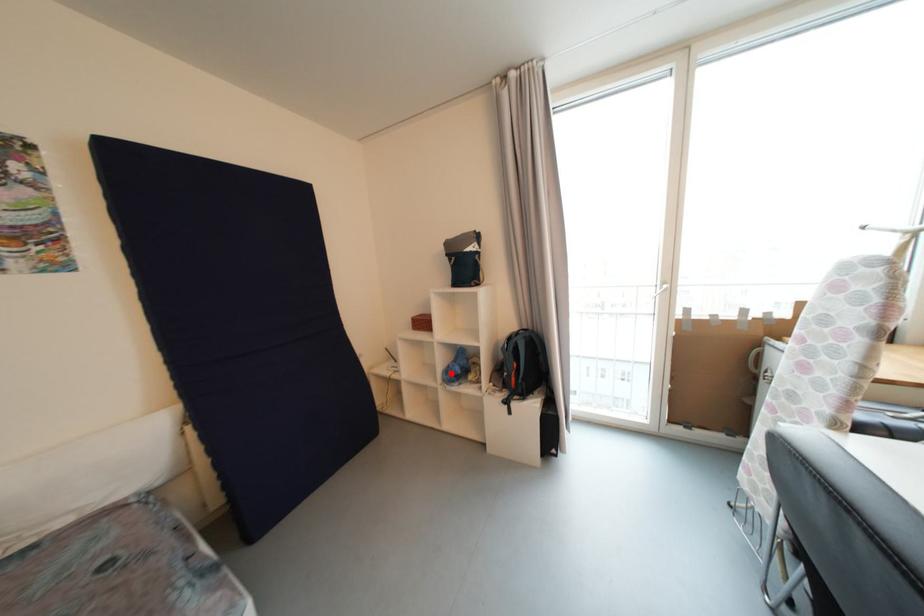
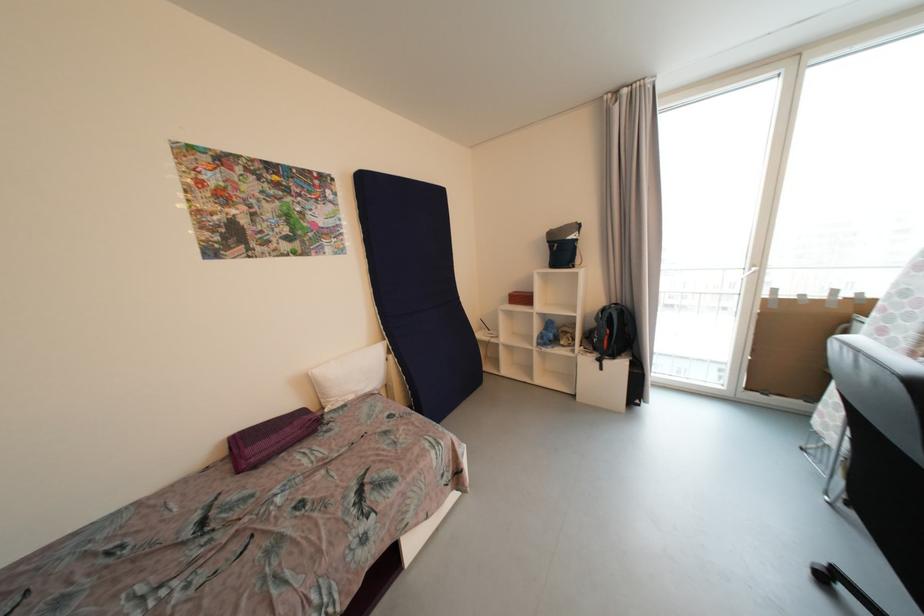
In the second image, find the point that corresponds to the highlighted location in the first image.

(545, 339)